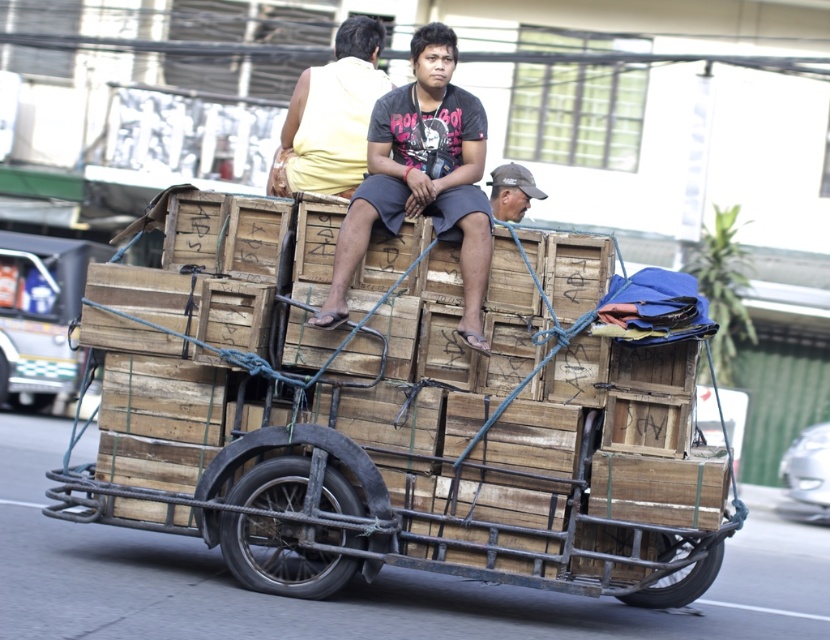
Is matte yellow shirt at upper center shorter than dark gray baseball cap at upper center?

In fact, matte yellow shirt at upper center may be taller than dark gray baseball cap at upper center.

Is point (374, 42) positioned before point (523, 196)?

No, (374, 42) is further to viewer.

The width and height of the screenshot is (830, 640). Find the location of `matte yellow shirt at upper center`. matte yellow shirt at upper center is located at coordinates (332, 115).

Does wooden crates at center appear on the left side of dark gray cotton t-shirt at center?

Yes, wooden crates at center is to the left of dark gray cotton t-shirt at center.

Which is above, wooden crates at center or dark gray cotton t-shirt at center?

dark gray cotton t-shirt at center

Which is behind, point (216, 376) or point (447, 218)?

Positioned behind is point (216, 376).

What are the coordinates of `wooden crates at center` in the screenshot? It's located at (401, 424).

Who is positioned more to the right, dark gray cotton t-shirt at center or dark gray baseball cap at upper center?

dark gray baseball cap at upper center

Is the position of dark gray cotton t-shirt at center less distant than that of dark gray baseball cap at upper center?

Yes, it is in front of dark gray baseball cap at upper center.

Where is `dark gray cotton t-shirt at center`? dark gray cotton t-shirt at center is located at coordinates (421, 177).